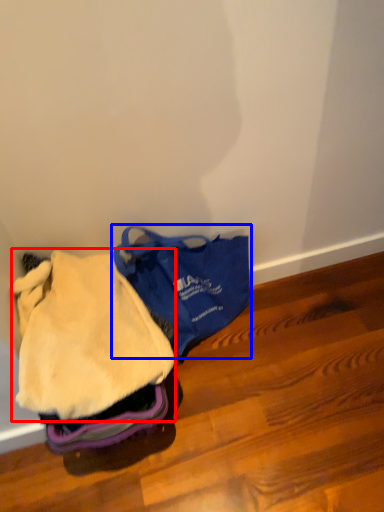
Question: Among these objects, which one is farthest to the camera, clothing (highlighted by a red box) or luggage and bags (highlighted by a blue box)?

Choices:
 (A) clothing
 (B) luggage and bags

Answer: (B)